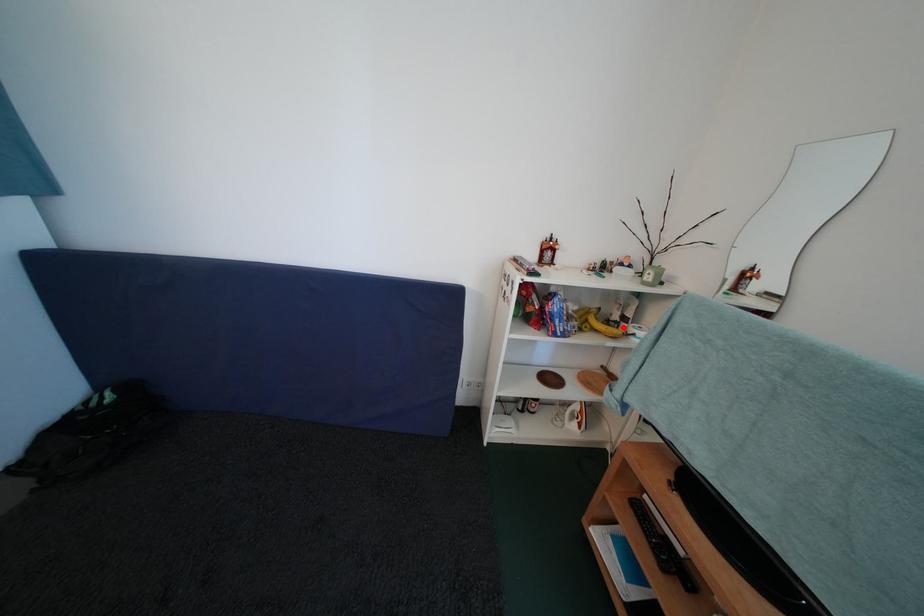
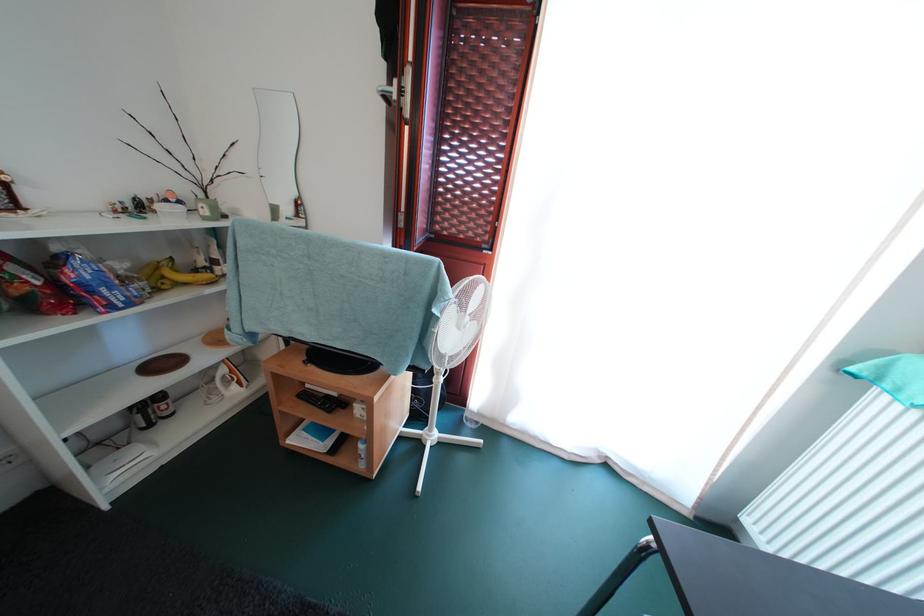
Find the pixel in the second image that matches the highlighted location in the first image.

(213, 273)